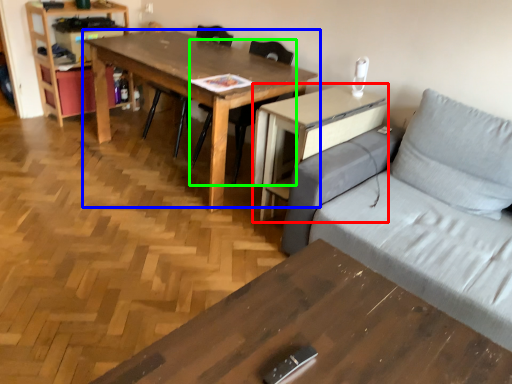
Question: Considering the real-world distances, which object is farthest from computer desk (highlighted by a red box)? table (highlighted by a blue box) or chair (highlighted by a green box)?

Choices:
 (A) table
 (B) chair

Answer: (B)